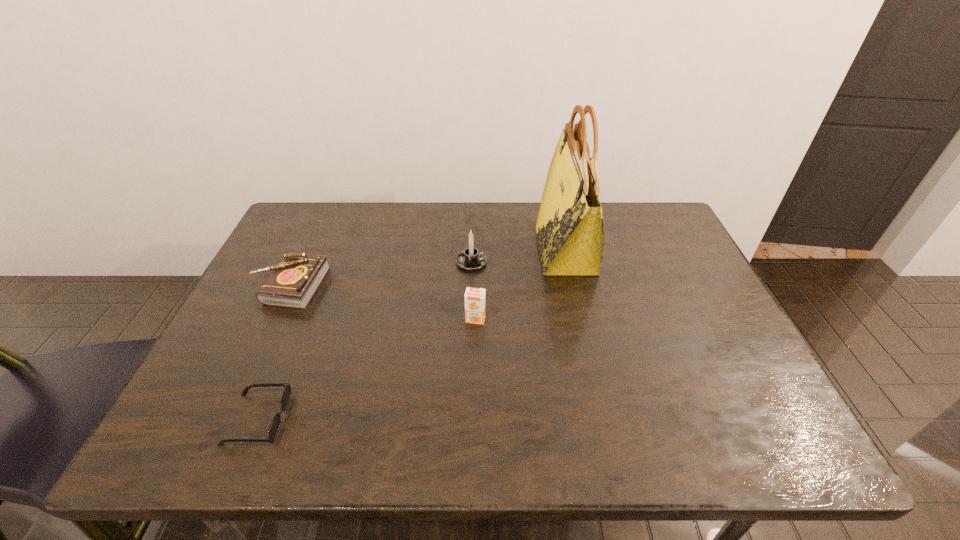
You are a GUI agent. You are given a task and a screenshot of the screen. Output one action in this format:
    pyautogui.click(x=<x>, y=<y>)
    Task: Click on the rightmost object
    The width and height of the screenshot is (960, 540).
    Given the screenshot: What is the action you would take?
    point(570,232)

Locate an element on the screen. tote bag is located at coordinates (570, 232).

The height and width of the screenshot is (540, 960). What are the coordinates of `the fourth shortest object` in the screenshot? It's located at (470, 259).

Where is `the third shortest object`? This screenshot has width=960, height=540. the third shortest object is located at coordinates (475, 298).

Locate an element on the screen. This screenshot has height=540, width=960. the second nearest object is located at coordinates (475, 298).

Locate an element on the screen. Image resolution: width=960 pixels, height=540 pixels. diary is located at coordinates (293, 282).

You are a GUI agent. You are given a task and a screenshot of the screen. Output one action in this format:
    pyautogui.click(x=<x>, y=<y>)
    Task: Click on the sunglasses
    
    Given the screenshot: What is the action you would take?
    pos(275,425)

The width and height of the screenshot is (960, 540). Find the location of `the shortest object`. the shortest object is located at coordinates (275, 425).

Find the location of a particular element. vacant space located 0.360m on the front-facing side of the rightmost object is located at coordinates (417, 250).

You are a GUI agent. You are given a task and a screenshot of the screen. Output one action in this format:
    pyautogui.click(x=<x>, y=<y>)
    Task: Click on the free region located on the front-facing side of the rightmost object
    
    Given the screenshot: What is the action you would take?
    pyautogui.click(x=482, y=250)